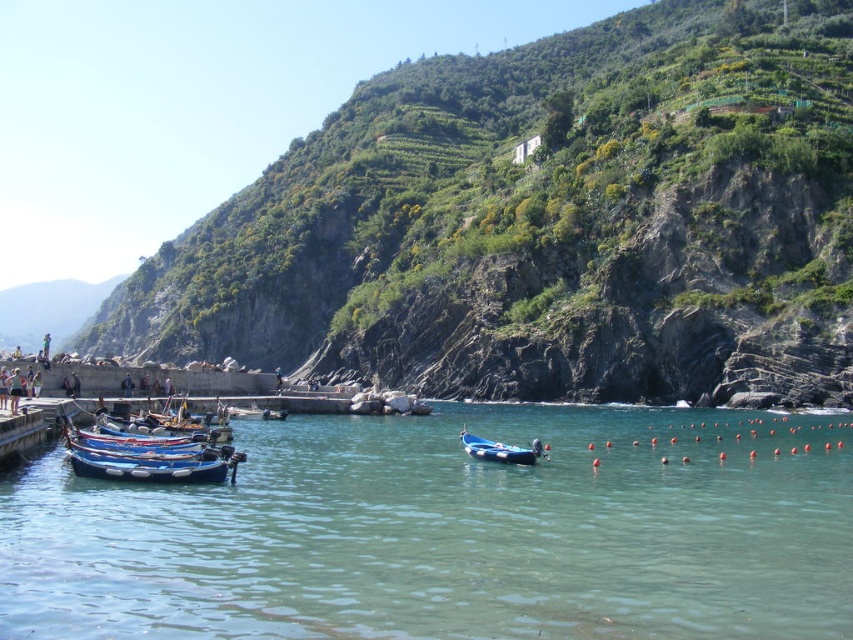
Based on the photo, you are standing on the pier and want to take a photo of the wooden boat at lower left and the clear blue water at center. Which object should you point your camera towards first if you want to capture both in one shot?

You should point your camera towards the wooden boat at lower left first because it is to the left of the clear blue water at center, allowing both to be captured in the same frame.

You are planning to take a photo of the coastal scene. You want to ensure both the green leafy hillside at upper center and the blue glossy boat at lower left are clearly visible in the frame. Which object should you adjust your camera angle to prioritize if the hillside is wider than the boat?

The green leafy hillside at upper center might be wider than the blue glossy boat at lower left, so you should prioritize adjusting your camera angle to include the wider hillside to ensure both are visible.